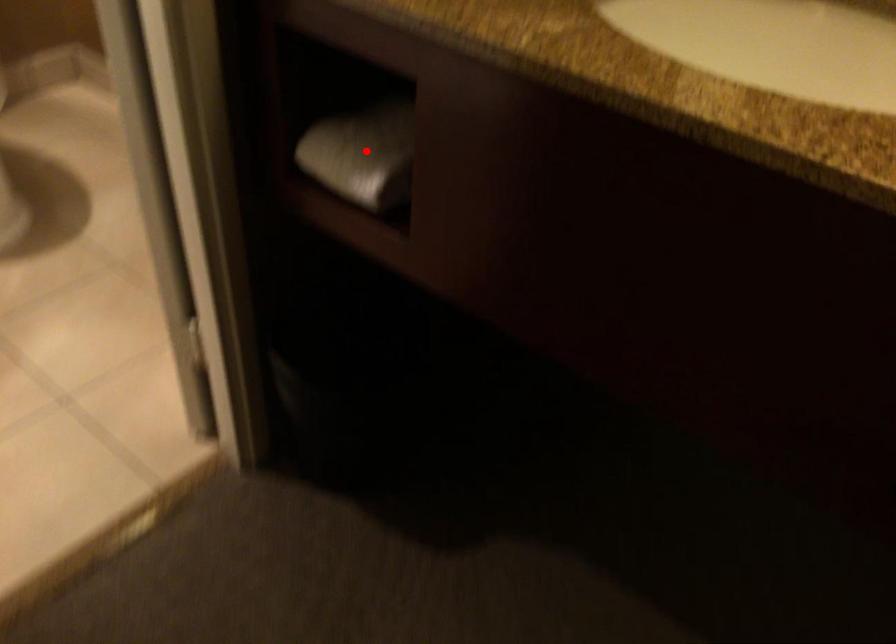
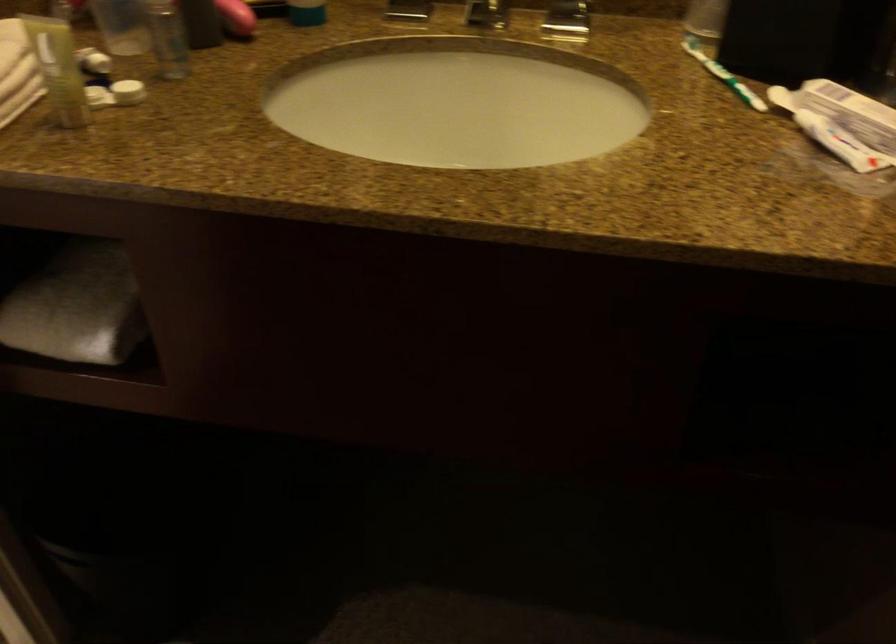
Where in the second image is the point corresponding to the highlighted location from the first image?

(76, 306)